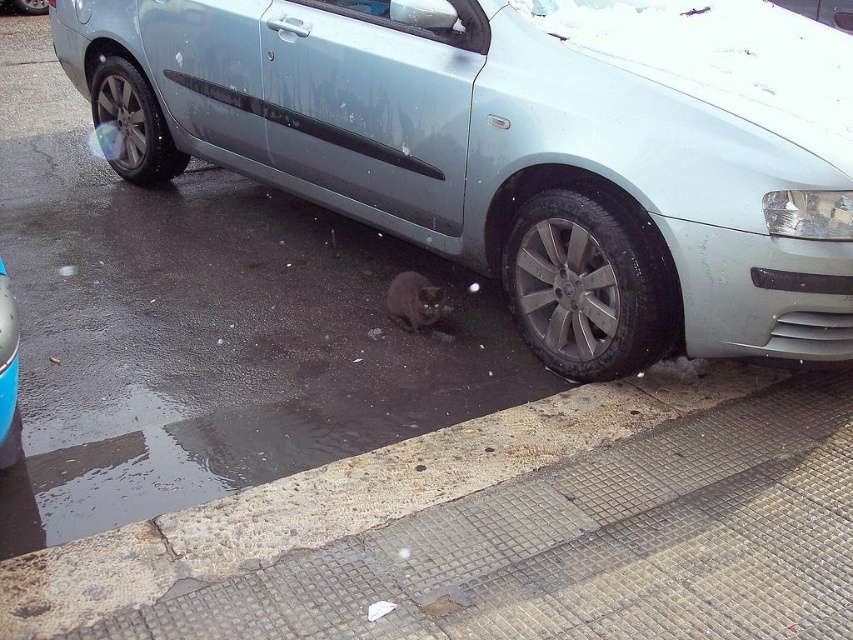
Who is lower down, slate metallic car at center or metallic silver car at lower left?

metallic silver car at lower left

Who is more distant from viewer, (796,314) or (15,339)?

The point (796,314) is behind.

Who is more distant from viewer, (639, 337) or (12, 397)?

Point (639, 337)

The image size is (853, 640). I want to click on slate metallic car at center, so click(x=538, y=150).

Is point (602, 205) more distant than point (180, 161)?

No, (602, 205) is closer to viewer.

Does black rubber tire at lower right appear over black rubber tire at lower left?

Actually, black rubber tire at lower right is below black rubber tire at lower left.

Between point (653, 307) and point (138, 100), which one is positioned behind?

The point (138, 100) is behind.

Identify the location of black rubber tire at lower right. (585, 285).

Does gray fur cat at lower center appear on the right side of metallic silver car at lower left?

Yes, gray fur cat at lower center is to the right of metallic silver car at lower left.

Does gray fur cat at lower center have a larger size compared to metallic silver car at lower left?

Correct, gray fur cat at lower center is larger in size than metallic silver car at lower left.

Between point (428, 307) and point (15, 365), which one is positioned in front?

Point (15, 365) is more forward.

Locate an element on the screen. The height and width of the screenshot is (640, 853). gray fur cat at lower center is located at coordinates point(416,301).